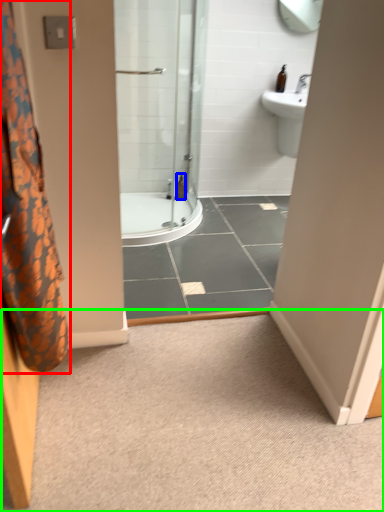
Question: Based on their relative distances, which object is nearer to shower curtain (highlighted by a red box)? Choose from toiletry (highlighted by a blue box) and plain (highlighted by a green box).

Choices:
 (A) toiletry
 (B) plain

Answer: (B)